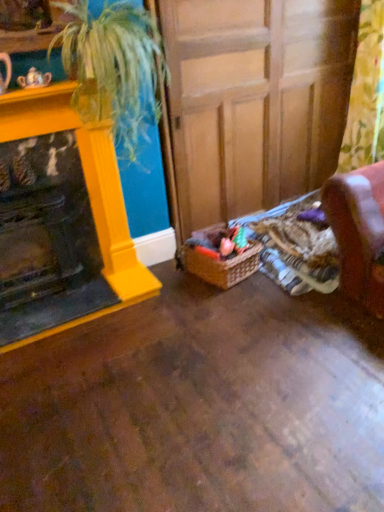
Question: From a real-world perspective, does floral fabric curtain at right sit lower than green leafy plant at upper left?

Choices:
 (A) no
 (B) yes

Answer: (B)

Question: Does floral fabric curtain at right come behind green leafy plant at upper left?

Choices:
 (A) no
 (B) yes

Answer: (B)

Question: Is floral fabric curtain at right to the left of green leafy plant at upper left from the viewer's perspective?

Choices:
 (A) yes
 (B) no

Answer: (B)

Question: Is floral fabric curtain at right surrounding green leafy plant at upper left?

Choices:
 (A) yes
 (B) no

Answer: (B)

Question: Is floral fabric curtain at right taller than green leafy plant at upper left?

Choices:
 (A) yes
 (B) no

Answer: (A)

Question: From a real-world perspective, is green leafy plant at upper left physically located above or below wooden at center?

Choices:
 (A) below
 (B) above

Answer: (B)

Question: In terms of height, does green leafy plant at upper left look taller or shorter compared to wooden at center?

Choices:
 (A) short
 (B) tall

Answer: (A)

Question: Is green leafy plant at upper left in front of or behind wooden at center in the image?

Choices:
 (A) behind
 (B) front

Answer: (B)

Question: Considering the positions of green leafy plant at upper left and wooden at center in the image, is green leafy plant at upper left wider or thinner than wooden at center?

Choices:
 (A) thin
 (B) wide

Answer: (A)

Question: Do you think woven brown basket at lower center is within matte yellow fireplace at left, or outside of it?

Choices:
 (A) inside
 (B) outside

Answer: (B)

Question: Considering the positions of woven brown basket at lower center and matte yellow fireplace at left in the image, is woven brown basket at lower center taller or shorter than matte yellow fireplace at left?

Choices:
 (A) short
 (B) tall

Answer: (A)

Question: Considering the positions of woven brown basket at lower center and matte yellow fireplace at left in the image, is woven brown basket at lower center bigger or smaller than matte yellow fireplace at left?

Choices:
 (A) big
 (B) small

Answer: (B)

Question: Is point (228, 260) positioned closer to the camera than point (57, 110)?

Choices:
 (A) farther
 (B) closer

Answer: (A)

Question: From the image's perspective, is matte yellow fireplace at left positioned above or below wooden at center?

Choices:
 (A) above
 (B) below

Answer: (B)

Question: Which is correct: matte yellow fireplace at left is inside wooden at center, or outside of it?

Choices:
 (A) outside
 (B) inside

Answer: (A)